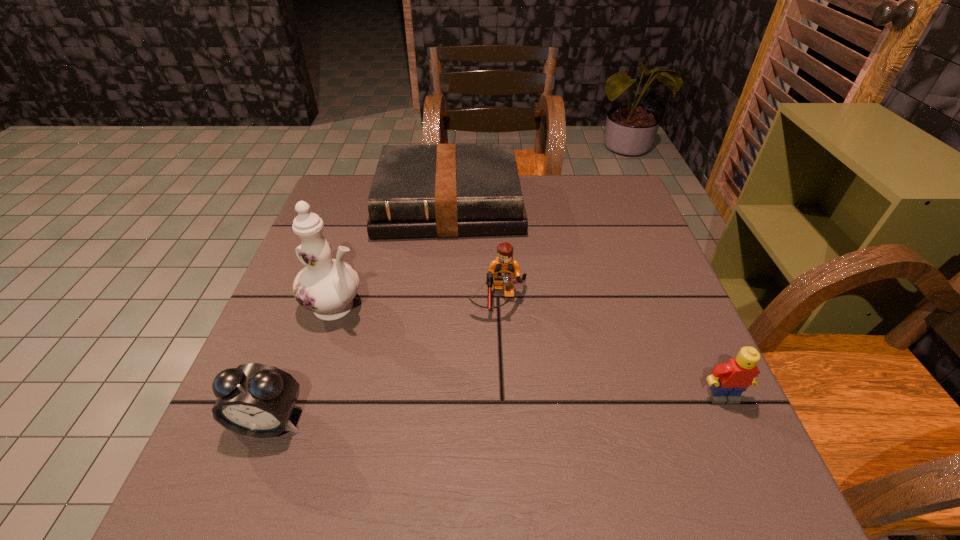
This screenshot has width=960, height=540. What are the coordinates of `vacant space on the desktop that is between the alarm clock and the nearer Lego and is positioned on the spine side of the hardback book` in the screenshot? It's located at (448, 411).

Where is `vacant space on the desktop that is between the alarm clock and the right Lego and is positioned holding a crossbow in the hands of the left Lego`? vacant space on the desktop that is between the alarm clock and the right Lego and is positioned holding a crossbow in the hands of the left Lego is located at coordinates (500, 409).

At what (x,y) coordinates should I click in order to perform the action: click on vacant space on the desktop that is between the alarm clock and the right Lego and is positioned at the spout of the chinaware. Please return your answer as a coordinate pair (x, y). Image resolution: width=960 pixels, height=540 pixels. Looking at the image, I should click on (516, 408).